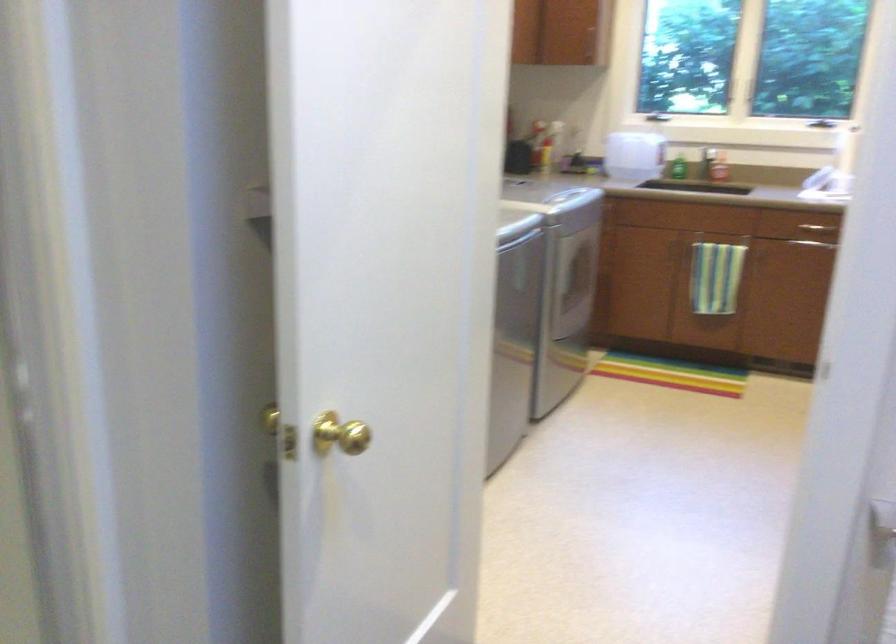
At what (x,y) coordinates should I click in order to perform the action: click on metal cabinet handle. Please return your answer as a coordinate pair (x, y). This screenshot has width=896, height=644. Looking at the image, I should click on (817, 228).